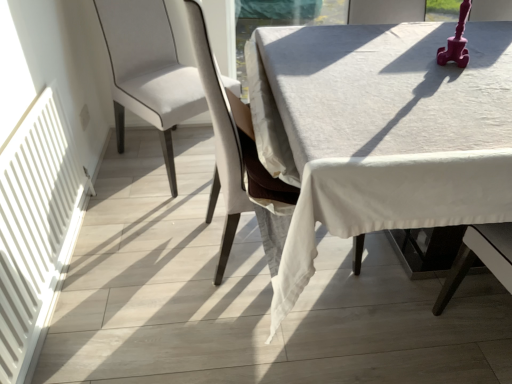
Find the location of `free location in front of satin white chair at center, which is the 1th chair in left-to-right order`. free location in front of satin white chair at center, which is the 1th chair in left-to-right order is located at coordinates (152, 206).